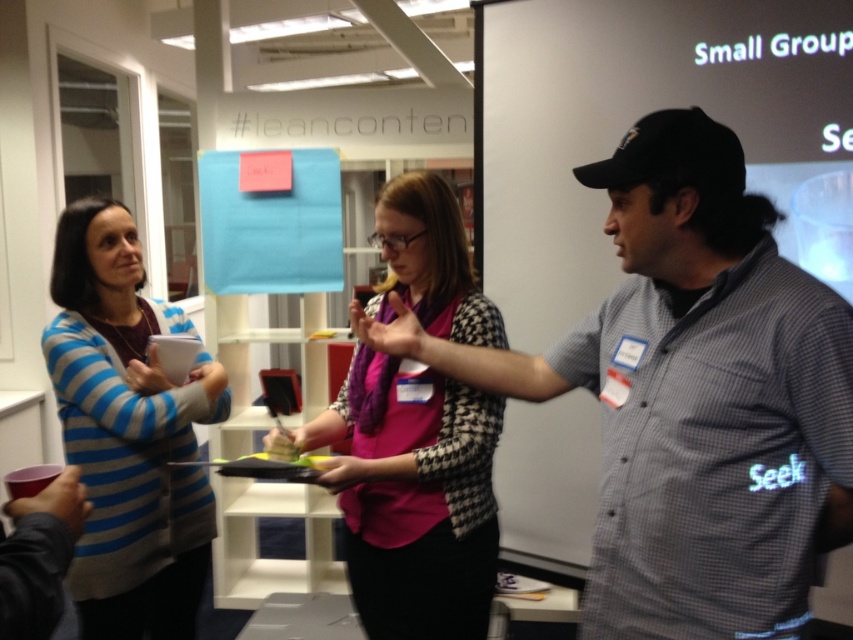
Can you confirm if gray checkered shirt at center is thinner than blue striped sweater at left?

In fact, gray checkered shirt at center might be wider than blue striped sweater at left.

I want to click on gray checkered shirt at center, so pos(692,396).

In the scene shown: Is gray checkered shirt at center bigger than pink fabric scarf at center?

Indeed, gray checkered shirt at center has a larger size compared to pink fabric scarf at center.

Does gray checkered shirt at center appear under pink fabric scarf at center?

No, gray checkered shirt at center is not below pink fabric scarf at center.

At what (x,y) coordinates should I click in order to perform the action: click on gray checkered shirt at center. Please return your answer as a coordinate pair (x, y). This screenshot has width=853, height=640. Looking at the image, I should click on (692, 396).

Who is more distant from viewer, (392, 257) or (86, 275)?

The point (86, 275) is more distant.

Is pink fabric scarf at center closer to the viewer compared to blue striped sweater at left?

Yes.

Describe the element at coordinates (410, 497) in the screenshot. I see `pink fabric scarf at center` at that location.

Locate an element on the screen. The image size is (853, 640). pink fabric scarf at center is located at coordinates (410, 497).